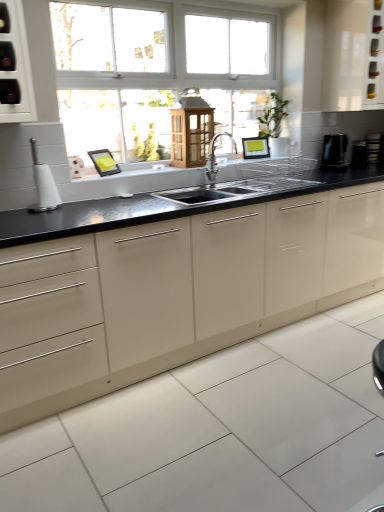
This screenshot has height=512, width=384. Find the location of `black plastic toaster at right, the 2th appliance in the back-to-front sequence`. black plastic toaster at right, the 2th appliance in the back-to-front sequence is located at coordinates (359, 154).

Where is `black granite countertop at center`? This screenshot has height=512, width=384. black granite countertop at center is located at coordinates (188, 289).

What are the coordinates of `wooden lantern at center, arranged as the 1th cabinetry when ordered from the bottom` in the screenshot? It's located at (191, 136).

Where is `black plastic toaster at right, arranged as the fourth appliance when viewed from the left`? black plastic toaster at right, arranged as the fourth appliance when viewed from the left is located at coordinates (373, 147).

Describe the element at coordinates (43, 185) in the screenshot. I see `white glossy toilet brush at left, which is counted as the 4th appliance, starting from the right` at that location.

What are the coordinates of `black plastic toaster at right, which is the 3th appliance in front-to-back order` in the screenshot? It's located at (359, 154).

Is black plastic toaster at right, which is the 3th appliance in front-to-back order, not within black plastic toaster at right, the 4th appliance in the front-to-back sequence?

That's correct, black plastic toaster at right, which is the 3th appliance in front-to-back order, is outside of black plastic toaster at right, the 4th appliance in the front-to-back sequence.

Which object is wider, black plastic toaster at right, which appears as the 2th appliance when viewed from the right, or black plastic toaster at right, the 1th appliance when ordered from right to left?

black plastic toaster at right, which appears as the 2th appliance when viewed from the right.

Considering the relative positions of black plastic toaster at right, the 2th appliance in the back-to-front sequence, and black plastic toaster at right, arranged as the fourth appliance when viewed from the left, in the image provided, is black plastic toaster at right, the 2th appliance in the back-to-front sequence, behind black plastic toaster at right, arranged as the fourth appliance when viewed from the left,?

No.

Which is further, [359,142] or [370,143]?

The point [359,142] is farther.

Which object is wider, wooden lantern at center, the 2th cabinetry when ordered from top to bottom, or white glossy toilet brush at left, the 1th appliance positioned from the left?

wooden lantern at center, the 2th cabinetry when ordered from top to bottom.

In terms of size, does wooden lantern at center, arranged as the 1th cabinetry when ordered from the bottom, appear bigger or smaller than white glossy toilet brush at left, which is the 1th appliance from front to back?

Considering their sizes, wooden lantern at center, arranged as the 1th cabinetry when ordered from the bottom, takes up more space than white glossy toilet brush at left, which is the 1th appliance from front to back.

Is white glossy toilet brush at left, the 1th appliance positioned from the left, inside wooden lantern at center, arranged as the 1th cabinetry when ordered from the bottom?

Actually, white glossy toilet brush at left, the 1th appliance positioned from the left, is outside wooden lantern at center, arranged as the 1th cabinetry when ordered from the bottom.

Where is `the 1st cabinetry counting from the right side of the white glossy toilet brush at left, which is counted as the 4th appliance, starting from the right`? This screenshot has width=384, height=512. the 1st cabinetry counting from the right side of the white glossy toilet brush at left, which is counted as the 4th appliance, starting from the right is located at coordinates (191, 136).

Is white glossy cabinet at upper right, the first cabinetry in the top-to-bottom sequence, located within black glossy kettle at right, arranged as the third appliance when viewed from the right?

That's incorrect, white glossy cabinet at upper right, the first cabinetry in the top-to-bottom sequence, is not inside black glossy kettle at right, arranged as the third appliance when viewed from the right.

Considering the points (344, 167) and (351, 70), which point is behind, point (344, 167) or point (351, 70)?

The point (344, 167) is farther.

Can you tell me how much black glossy kettle at right, arranged as the third appliance when viewed from the right, and white glossy cabinet at upper right, acting as the 1th cabinetry starting from the right, differ in facing direction?

The facing directions of black glossy kettle at right, arranged as the third appliance when viewed from the right, and white glossy cabinet at upper right, acting as the 1th cabinetry starting from the right, are 5.82 degrees apart.

Is the position of black glossy kettle at right, the 2th appliance viewed from the left, less distant than that of white glossy cabinet at upper right, arranged as the 2th cabinetry when viewed from the left?

No, the depth of black glossy kettle at right, the 2th appliance viewed from the left, is greater than that of white glossy cabinet at upper right, arranged as the 2th cabinetry when viewed from the left.

Considering the relative sizes of black granite countertop at center and wooden lantern at center, arranged as the 1th cabinetry when ordered from the bottom, in the image provided, is black granite countertop at center shorter than wooden lantern at center, arranged as the 1th cabinetry when ordered from the bottom,?

No.

From a real-world perspective, which is physically above, black granite countertop at center or wooden lantern at center, the 2th cabinetry when ordered from top to bottom?

From a 3D spatial view, wooden lantern at center, the 2th cabinetry when ordered from top to bottom, is above.

Is black granite countertop at center not close to wooden lantern at center, which appears as the second cabinetry when viewed from the right?

No, black granite countertop at center is not far away from wooden lantern at center, which appears as the second cabinetry when viewed from the right.

Looking at this image, is black granite countertop at center oriented away from wooden lantern at center, the 2th cabinetry when ordered from top to bottom?

No, black granite countertop at center is not facing the opposite direction of wooden lantern at center, the 2th cabinetry when ordered from top to bottom.

Is wooden lantern at center, arranged as the 1th cabinetry when ordered from the bottom, next to black granite countertop at center?

No, wooden lantern at center, arranged as the 1th cabinetry when ordered from the bottom, is not making contact with black granite countertop at center.

Considering the relative positions of wooden lantern at center, arranged as the 1th cabinetry when ordered from the bottom, and black granite countertop at center in the image provided, is wooden lantern at center, arranged as the 1th cabinetry when ordered from the bottom, to the left of black granite countertop at center from the viewer's perspective?

Yes.

Which of these two, wooden lantern at center, which appears as the second cabinetry when viewed from the right, or black granite countertop at center, is bigger?

black granite countertop at center.

Between wooden lantern at center, the 2th cabinetry when ordered from top to bottom, and black granite countertop at center, which one is positioned behind?

wooden lantern at center, the 2th cabinetry when ordered from top to bottom, is behind.

In terms of height, does black granite countertop at center look taller or shorter compared to black plastic toaster at right, the 2th appliance in the back-to-front sequence?

In the image, black granite countertop at center appears to be taller than black plastic toaster at right, the 2th appliance in the back-to-front sequence.

Is black granite countertop at center far away from black plastic toaster at right, which appears as the 2th appliance when viewed from the right?

black granite countertop at center is far away from black plastic toaster at right, which appears as the 2th appliance when viewed from the right.

Between black granite countertop at center and black plastic toaster at right, which is the 3th appliance in front-to-back order, which one has smaller width?

With smaller width is black plastic toaster at right, which is the 3th appliance in front-to-back order.

From a real-world perspective, is black granite countertop at center physically located above or below black plastic toaster at right, the 2th appliance in the back-to-front sequence?

In terms of real-world spatial position, black granite countertop at center is below black plastic toaster at right, the 2th appliance in the back-to-front sequence.

Based on the photo, is white glossy cabinet at upper right, the 2th cabinetry from the bottom, a part of silver metallic faucet at center?

No, silver metallic faucet at center does not contain white glossy cabinet at upper right, the 2th cabinetry from the bottom.

Does silver metallic faucet at center have a larger size compared to white glossy cabinet at upper right, acting as the 1th cabinetry starting from the right?

No.

Is white glossy cabinet at upper right, acting as the 1th cabinetry starting from the right, at the back of silver metallic faucet at center?

silver metallic faucet at center does not have its back to white glossy cabinet at upper right, acting as the 1th cabinetry starting from the right.

Is point (211, 167) more distant than point (352, 84)?

No, it is not.

This screenshot has height=512, width=384. I want to click on the 1st appliance to the left of the black plastic toaster at right, arranged as the fourth appliance when viewed from the left, starting your count from the anchor, so click(359, 154).

I want to click on appliance in front of the wooden lantern at center, the 2th cabinetry when ordered from top to bottom, so click(43, 185).

When comparing their distances from black plastic toaster at right, the 2th appliance in the back-to-front sequence, does black plastic toaster at right, the 1th appliance when ordered from right to left, or white glossy toilet brush at left, which is counted as the 4th appliance, starting from the right, seem further?

Among the two, white glossy toilet brush at left, which is counted as the 4th appliance, starting from the right, is located further to black plastic toaster at right, the 2th appliance in the back-to-front sequence.

Based on their spatial positions, is wooden lantern at center, the 2th cabinetry when ordered from top to bottom, or white glossy toilet brush at left, which is counted as the 4th appliance, starting from the right, further from white glossy cabinet at upper right, the first cabinetry in the top-to-bottom sequence?

white glossy toilet brush at left, which is counted as the 4th appliance, starting from the right, is further to white glossy cabinet at upper right, the first cabinetry in the top-to-bottom sequence.

Based on the photo, when comparing their distances from black granite countertop at center, does black plastic toaster at right, which appears as the 2th appliance when viewed from the right, or white glossy toilet brush at left, which is the 1th appliance from front to back, seem closer?

The object closer to black granite countertop at center is white glossy toilet brush at left, which is the 1th appliance from front to back.

Which object lies further to the anchor point black glossy kettle at right, which is counted as the third appliance, starting from the back, black granite countertop at center or white glossy cabinet at upper right, arranged as the 2th cabinetry when viewed from the left?

Based on the image, black granite countertop at center appears to be further to black glossy kettle at right, which is counted as the third appliance, starting from the back.

From the picture: Based on their spatial positions, is wooden lantern at center, placed as the 1th cabinetry when sorted from left to right, or white glossy cabinet at upper right, the first cabinetry in the top-to-bottom sequence, closer to black plastic toaster at right, the 2th appliance in the back-to-front sequence?

Among the two, white glossy cabinet at upper right, the first cabinetry in the top-to-bottom sequence, is located nearer to black plastic toaster at right, the 2th appliance in the back-to-front sequence.

Based on their spatial positions, is black plastic toaster at right, which is the 3th appliance in front-to-back order, or black granite countertop at center further from white glossy cabinet at upper right, acting as the 1th cabinetry starting from the right?

Among the two, black granite countertop at center is located further to white glossy cabinet at upper right, acting as the 1th cabinetry starting from the right.

In the scene shown: When comparing their distances from white glossy toilet brush at left, which is counted as the 4th appliance, starting from the right, does black plastic toaster at right, which appears as the 2th appliance when viewed from the right, or black plastic toaster at right, arranged as the fourth appliance when viewed from the left, seem further?

black plastic toaster at right, arranged as the fourth appliance when viewed from the left.

Which object lies nearer to the anchor point white glossy toilet brush at left, the fourth appliance from the back, silver metallic faucet at center or black granite countertop at center?

Based on the image, black granite countertop at center appears to be nearer to white glossy toilet brush at left, the fourth appliance from the back.

Where is `tap located between wooden lantern at center, the 2th cabinetry when ordered from top to bottom, and black glossy kettle at right, the 2th appliance viewed from the left, in the left-right direction`? This screenshot has height=512, width=384. tap located between wooden lantern at center, the 2th cabinetry when ordered from top to bottom, and black glossy kettle at right, the 2th appliance viewed from the left, in the left-right direction is located at coordinates (215, 157).

Where is `cabinetry between white glossy toilet brush at left, the 1th appliance positioned from the left, and black plastic toaster at right, the 2th appliance in the back-to-front sequence, in the horizontal direction`? cabinetry between white glossy toilet brush at left, the 1th appliance positioned from the left, and black plastic toaster at right, the 2th appliance in the back-to-front sequence, in the horizontal direction is located at coordinates (191, 136).

The height and width of the screenshot is (512, 384). Identify the location of tap positioned between black granite countertop at center and black plastic toaster at right, which appears as the 2th appliance when viewed from the right, from near to far. (215, 157).

Locate an element on the screen. The width and height of the screenshot is (384, 512). tap situated between white glossy toilet brush at left, which is the 1th appliance from front to back, and black plastic toaster at right, arranged as the fourth appliance when viewed from the left, from left to right is located at coordinates (215, 157).